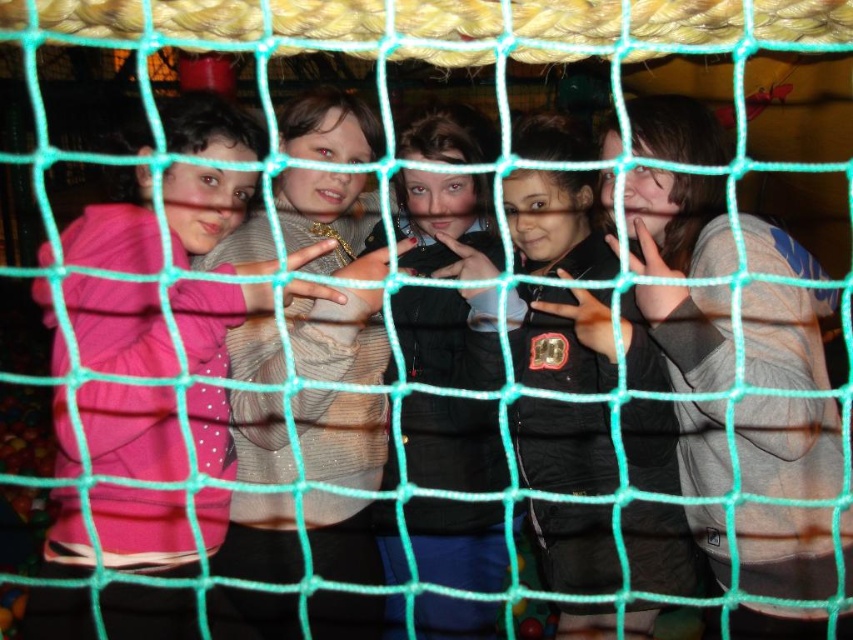
You are a photographer standing in front of the green netting structure. You want to take a closeup photo of the pink matte jacket at left. Considering your current position, can you step forward to get a closer shot without exceeding the 4 feet safety distance rule?

The pink matte jacket at left is currently 3.75 feet away from the viewer. Since 3.75 feet is less than 4 feet, you are already within the safety distance and can take the closeup photo without moving forward further.

Consider the image. You are a photographer trying to capture the gray cotton hoodie at right in the center of your photo. The camera is currently focused on the point at the center of the image. The coordinates of the center are at point 0.5, 0.5. The coordinates of the gray cotton hoodie at right are at point (677, 225). To center the gray cotton hoodie at right in your photo, should you move the camera focus to the left or to the right?

The gray cotton hoodie at right is located at coordinates (677, 225). The center of the image is at 0.5, 0.5. To center the hoodie, you need to move the focus to the left because the hoodie is to the right of the current focus point.